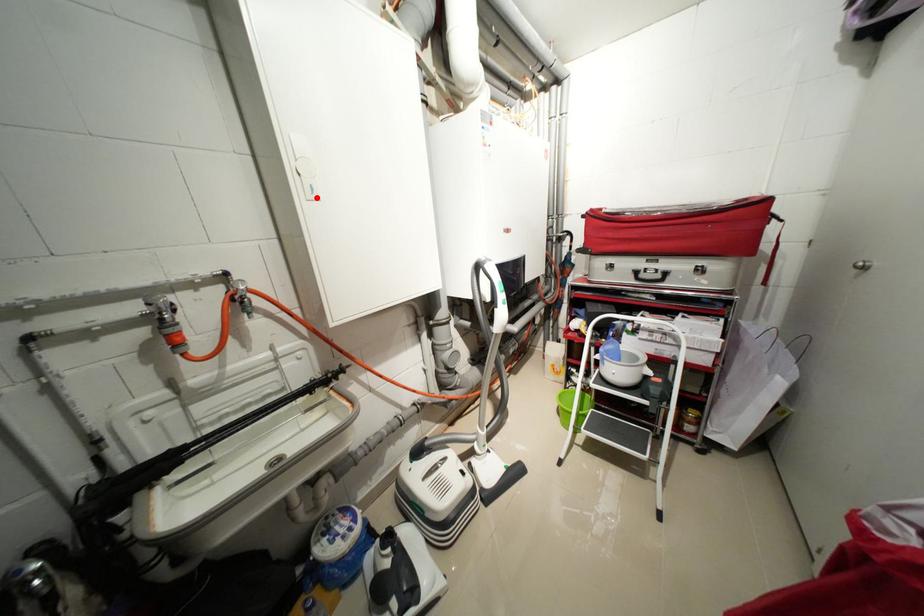
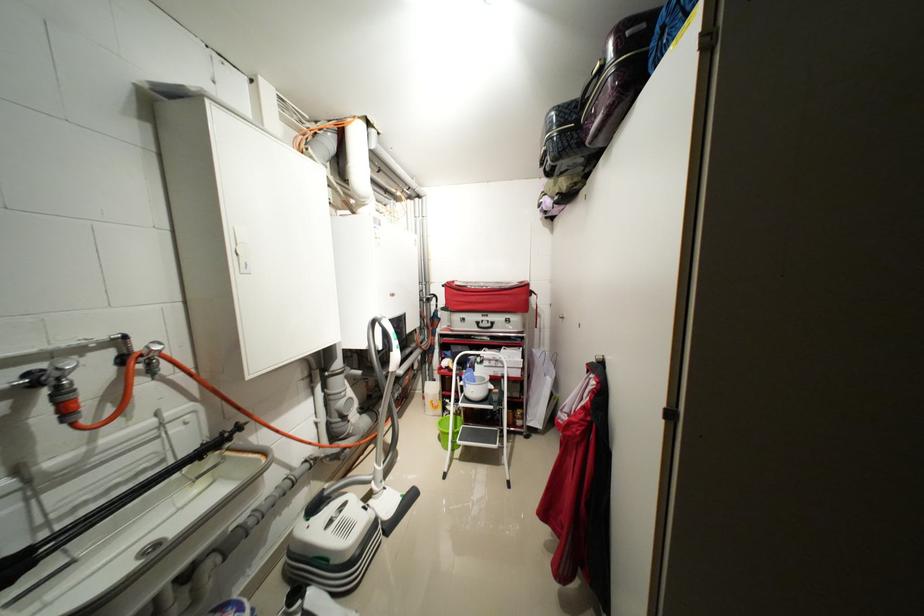
Where in the second image is the point corresponding to the highlighted location from the first image?

(250, 272)